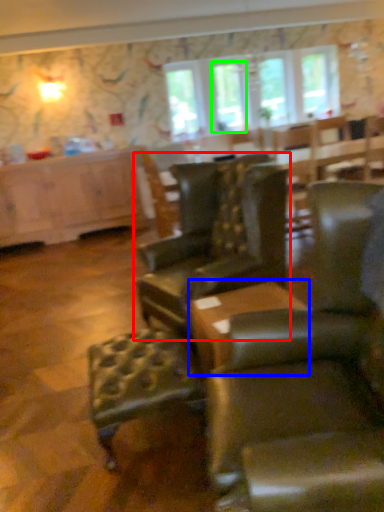
Question: Which object is positioned closest to chair (highlighted by a red box)? Select from table (highlighted by a blue box) and window (highlighted by a green box).

Choices:
 (A) table
 (B) window

Answer: (A)